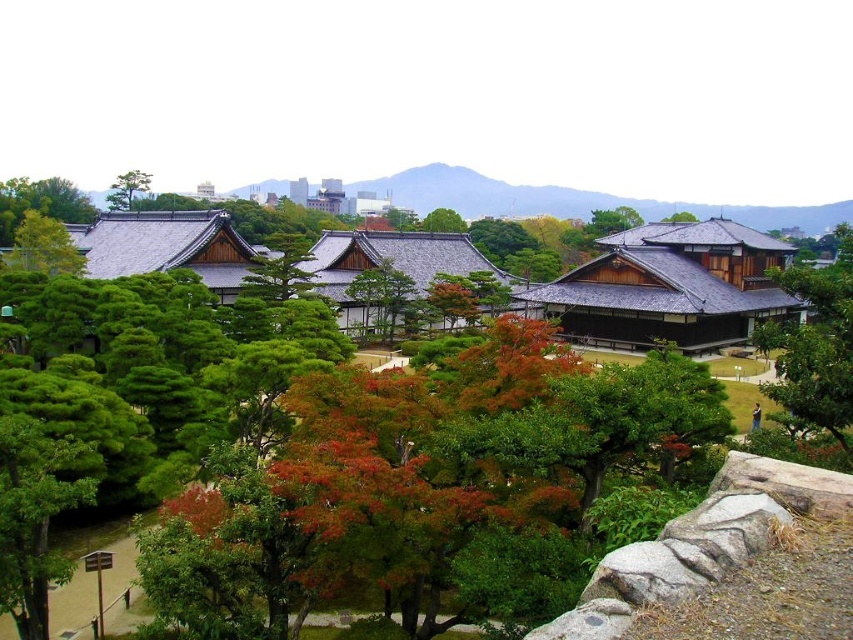
Question: Does green matte tree at center appear over green matte tree at upper center?

Choices:
 (A) yes
 (B) no

Answer: (A)

Question: Estimate the real-world distances between objects in this image. Which object is farther from the green grassy hillside at center?

Choices:
 (A) green matte tree at upper left
 (B) green matte tree at upper center
 (C) green leafy tree at right
 (D) green matte tree at center

Answer: (C)

Question: Which of the following is the closest to the observer?

Choices:
 (A) (691, 218)
 (B) (751, 221)
 (C) (456, 225)

Answer: (C)

Question: Is green leafy tree at right below green matte tree at upper center?

Choices:
 (A) yes
 (B) no

Answer: (A)

Question: Does green leafy tree at right have a greater width compared to green matte tree at upper center?

Choices:
 (A) yes
 (B) no

Answer: (A)

Question: Which point is farther to the camera?

Choices:
 (A) green grassy hillside at center
 (B) green matte tree at upper left
 (C) green leafy tree at right

Answer: (A)